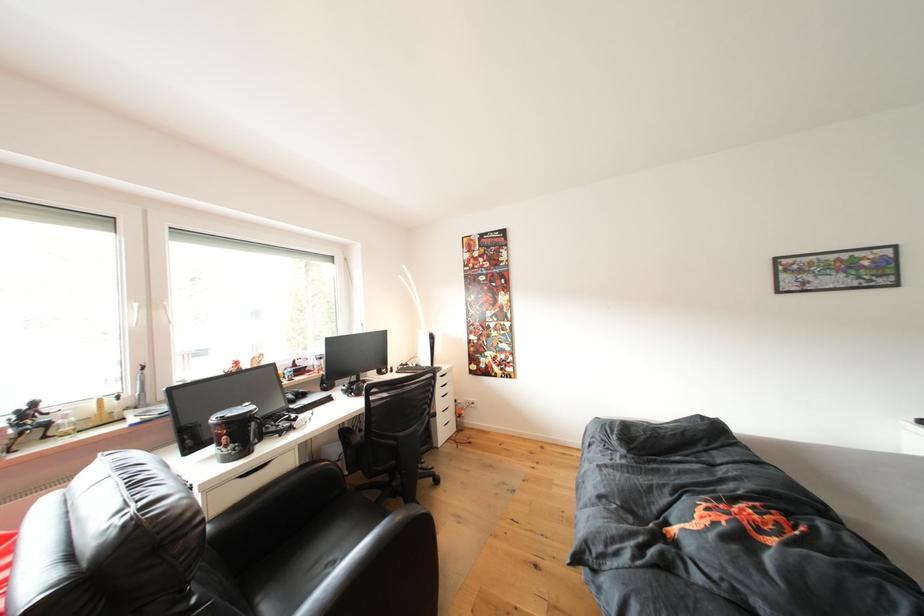
Where would you lift the black mug handle? Please return your answer as a coordinate pair (x, y).

(256, 430)